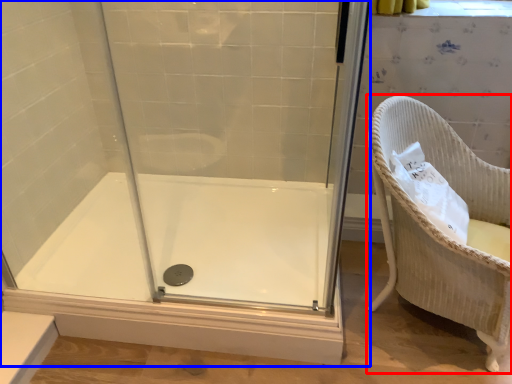
Question: Which of the following is the farthest to the observer, furniture (highlighted by a red box) or shower door (highlighted by a blue box)?

Choices:
 (A) furniture
 (B) shower door

Answer: (A)